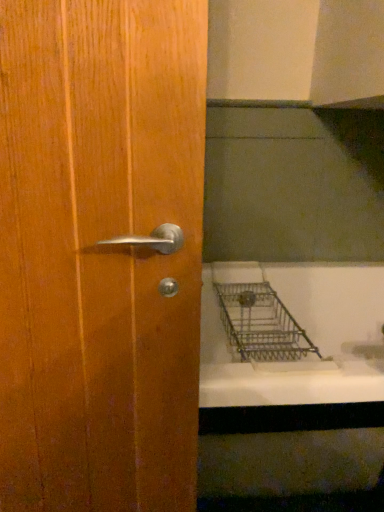
Where is `metallic wire basket at lower right`? This screenshot has height=512, width=384. metallic wire basket at lower right is located at coordinates (292, 335).

This screenshot has width=384, height=512. Describe the element at coordinates (292, 335) in the screenshot. I see `metallic wire basket at lower right` at that location.

Where is `metallic wire basket at lower right`? metallic wire basket at lower right is located at coordinates (292, 335).